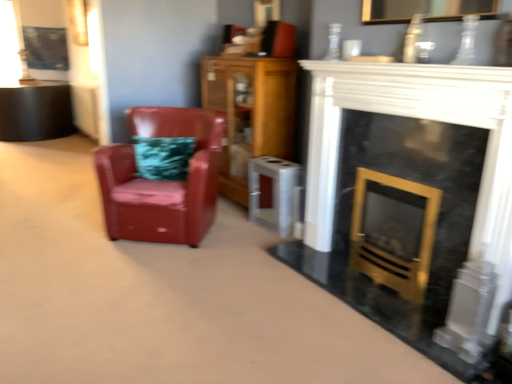
At what (x,y) coordinates should I click in order to perform the action: click on blank space to the left of glossy leather armchair at left. Please return your answer as a coordinate pair (x, y). Image resolution: width=512 pixels, height=384 pixels. Looking at the image, I should click on (64, 228).